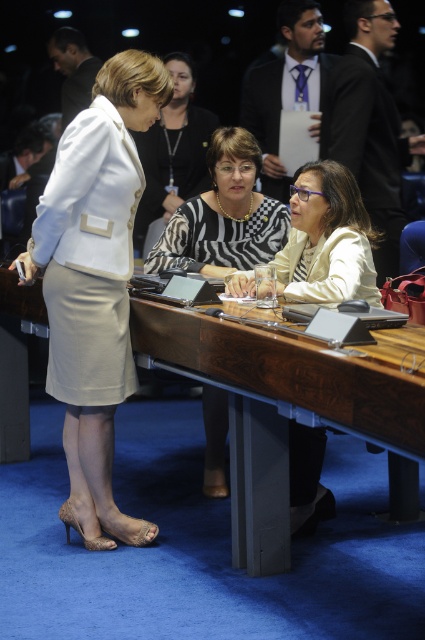
Question: Among these points, which one is nearest to the camera?

Choices:
 (A) (167, 246)
 (B) (67, 77)
 (C) (232, 422)

Answer: (C)

Question: Estimate the real-world distances between objects in this image. Which object is farther from the white matte blazer at upper left?

Choices:
 (A) beige fabric skirt at lower left
 (B) formal black suit at upper center
 (C) light beige skirt at lower center
 (D) wooden at center

Answer: (D)

Question: Does wooden at center appear on the left side of light beige skirt at lower center?

Choices:
 (A) no
 (B) yes

Answer: (B)

Question: Based on their relative distances, which object is farther from the wooden at center?

Choices:
 (A) zebra print blouse at center
 (B) beige fabric skirt at lower left
 (C) zebra-patterned blouse at center

Answer: (A)

Question: Does zebra-patterned blouse at center come behind white matte blazer at upper left?

Choices:
 (A) no
 (B) yes

Answer: (A)

Question: In this image, where is beige fabric skirt at lower left located relative to matte beige blazer at center?

Choices:
 (A) below
 (B) above

Answer: (A)